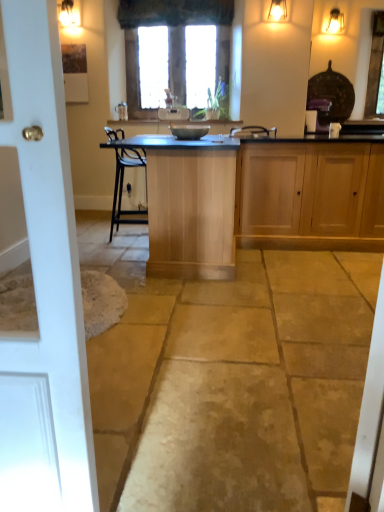
Question: From a real-world perspective, is matte gold light fixture at upper right on top of matte silver faucet at center?

Choices:
 (A) yes
 (B) no

Answer: (A)

Question: Does matte gold light fixture at upper right have a lesser width compared to matte silver faucet at center?

Choices:
 (A) yes
 (B) no

Answer: (B)

Question: From a real-world perspective, is matte gold light fixture at upper right located beneath matte silver faucet at center?

Choices:
 (A) yes
 (B) no

Answer: (B)

Question: Considering the relative sizes of matte gold light fixture at upper right and matte silver faucet at center in the image provided, is matte gold light fixture at upper right smaller than matte silver faucet at center?

Choices:
 (A) no
 (B) yes

Answer: (A)

Question: Is matte gold light fixture at upper right wider than matte silver faucet at center?

Choices:
 (A) yes
 (B) no

Answer: (A)

Question: In terms of width, does matte silver faucet at center look wider or thinner when compared to white wood door at left?

Choices:
 (A) thin
 (B) wide

Answer: (B)

Question: Relative to white wood door at left, is matte silver faucet at center in front or behind?

Choices:
 (A) behind
 (B) front

Answer: (A)

Question: In terms of size, does matte silver faucet at center appear bigger or smaller than white wood door at left?

Choices:
 (A) small
 (B) big

Answer: (A)

Question: From a real-world perspective, is matte silver faucet at center positioned above or below white wood door at left?

Choices:
 (A) below
 (B) above

Answer: (B)

Question: Considering the positions of point (306, 301) and point (162, 217), is point (306, 301) closer or farther from the camera than point (162, 217)?

Choices:
 (A) farther
 (B) closer

Answer: (B)

Question: From a real-world perspective, is natural stone floor at center above or below light wood table at center?

Choices:
 (A) above
 (B) below

Answer: (B)

Question: Considering their positions, is natural stone floor at center located in front of or behind light wood table at center?

Choices:
 (A) behind
 (B) front

Answer: (B)

Question: From the image's perspective, is natural stone floor at center above or below light wood table at center?

Choices:
 (A) below
 (B) above

Answer: (A)

Question: Relative to natural stone floor at center, is light wood cabinet at right in front or behind?

Choices:
 (A) behind
 (B) front

Answer: (A)

Question: Considering the positions of light wood cabinet at right and natural stone floor at center in the image, is light wood cabinet at right wider or thinner than natural stone floor at center?

Choices:
 (A) wide
 (B) thin

Answer: (B)